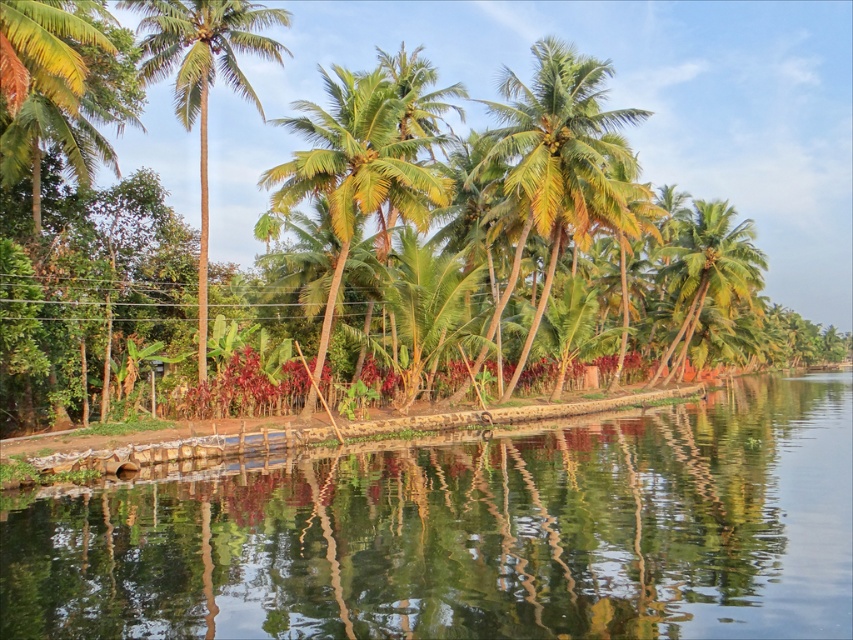
You are standing on the shore looking at the clear water at center and the green leafy palm tree at center. Which object is closer to the water surface?

The clear water at center is located below the green leafy palm tree at center, so the clear water at center is closer to the water surface.

You are standing on the shore of the tropical landscape and want to take a photo of the green leafy palm trees at center and the clear water at center. Which object should you focus on first if you want to capture both in one frame?

You should focus on the green leafy palm trees at center first because they are above the clear water at center, making them closer to the camera.